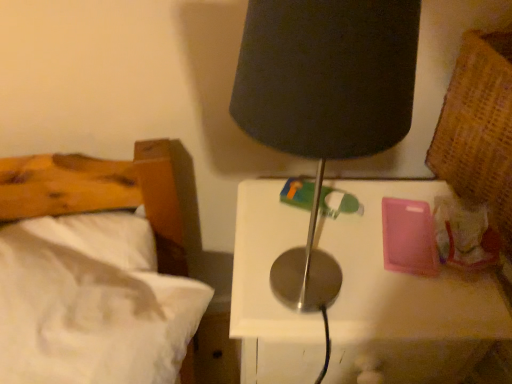
This screenshot has width=512, height=384. In order to click on vacant region under black fabric lamp at upper center (from a real-world perspective) in this screenshot , I will do `click(281, 297)`.